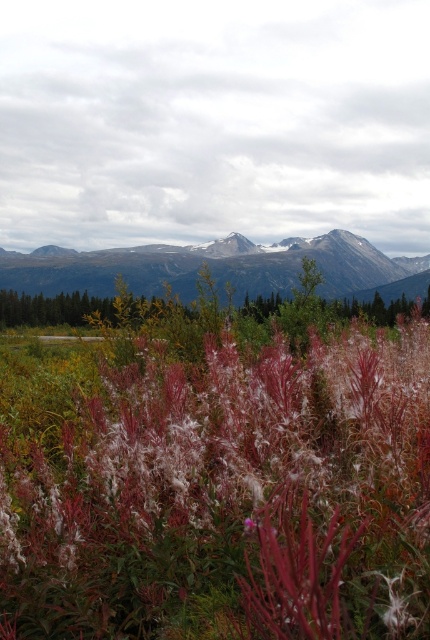
Question: Can you confirm if fuzzy pink plant at center is positioned above rocky gray mountains at center?

Choices:
 (A) no
 (B) yes

Answer: (A)

Question: Among these objects, which one is farthest from the camera?

Choices:
 (A) rocky gray mountains at center
 (B) fuzzy pink plant at center

Answer: (A)

Question: Is fuzzy pink plant at center wider than rocky gray mountains at center?

Choices:
 (A) yes
 (B) no

Answer: (B)

Question: Is fuzzy pink plant at center thinner than rocky gray mountains at center?

Choices:
 (A) no
 (B) yes

Answer: (B)